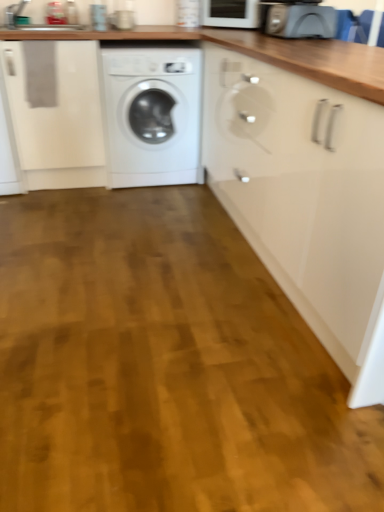
Question: From a real-world perspective, is white glossy washing machine at center located beneath matte gray toaster at upper right, marked as the first appliance in a front-to-back arrangement?

Choices:
 (A) no
 (B) yes

Answer: (B)

Question: Is there a large distance between white glossy washing machine at center and matte gray toaster at upper right, which is counted as the first appliance, starting from the bottom?

Choices:
 (A) no
 (B) yes

Answer: (A)

Question: From the image's perspective, is white glossy washing machine at center beneath matte gray toaster at upper right, marked as the first appliance in a front-to-back arrangement?

Choices:
 (A) yes
 (B) no

Answer: (A)

Question: Considering the relative sizes of white glossy washing machine at center and matte gray toaster at upper right, which is counted as the first appliance, starting from the bottom, in the image provided, is white glossy washing machine at center wider than matte gray toaster at upper right, which is counted as the first appliance, starting from the bottom,?

Choices:
 (A) yes
 (B) no

Answer: (A)

Question: Can you confirm if white glossy washing machine at center is shorter than matte gray toaster at upper right, which is counted as the first appliance, starting from the bottom?

Choices:
 (A) no
 (B) yes

Answer: (A)

Question: In terms of width, does white glossy microwave at upper center, positioned as the second appliance in bottom-to-top order, look wider or thinner when compared to wooden floor at center?

Choices:
 (A) thin
 (B) wide

Answer: (A)

Question: Choose the correct answer: Is white glossy microwave at upper center, positioned as the second appliance in bottom-to-top order, inside wooden floor at center or outside it?

Choices:
 (A) inside
 (B) outside

Answer: (B)

Question: Based on their positions, is white glossy microwave at upper center, the second appliance when ordered from front to back, located to the left or right of wooden floor at center?

Choices:
 (A) right
 (B) left

Answer: (A)

Question: Is white glossy microwave at upper center, positioned as the second appliance in bottom-to-top order, bigger or smaller than wooden floor at center?

Choices:
 (A) big
 (B) small

Answer: (B)

Question: From the image's perspective, is white glossy washing machine at center above or below wooden floor at center?

Choices:
 (A) above
 (B) below

Answer: (A)

Question: From a real-world perspective, is white glossy washing machine at center positioned above or below wooden floor at center?

Choices:
 (A) below
 (B) above

Answer: (B)

Question: Does point (125, 53) appear closer or farther from the camera than point (122, 395)?

Choices:
 (A) farther
 (B) closer

Answer: (A)

Question: In terms of size, does white glossy washing machine at center appear bigger or smaller than wooden floor at center?

Choices:
 (A) big
 (B) small

Answer: (A)

Question: Is glossy white cabinet at center inside the boundaries of white glossy washing machine at center, or outside?

Choices:
 (A) outside
 (B) inside

Answer: (A)

Question: Considering the positions of glossy white cabinet at center and white glossy washing machine at center in the image, is glossy white cabinet at center taller or shorter than white glossy washing machine at center?

Choices:
 (A) tall
 (B) short

Answer: (A)